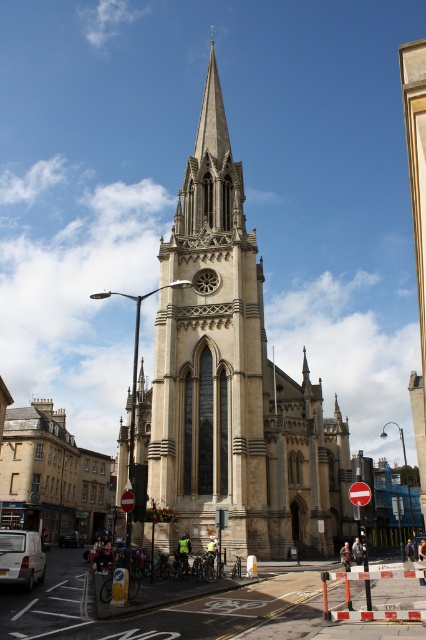
Question: Which object appears closest to the camera in this image?

Choices:
 (A) white matte van at lower left
 (B) metallic silver car at lower left
 (C) beige stone church at lower left

Answer: (A)

Question: Which object appears farthest from the camera in this image?

Choices:
 (A) metallic silver car at lower left
 (B) beige stone tower at center
 (C) white matte van at lower left
 (D) beige stone church at lower left

Answer: (A)

Question: Can you confirm if beige stone church at lower left is bigger than metallic silver car at lower left?

Choices:
 (A) no
 (B) yes

Answer: (B)

Question: Can you confirm if beige stone tower at center is positioned below white matte van at lower left?

Choices:
 (A) yes
 (B) no

Answer: (B)

Question: Is beige stone tower at center to the right of beige stone church at lower left from the viewer's perspective?

Choices:
 (A) no
 (B) yes

Answer: (B)

Question: Which is farther from the beige stone tower at center?

Choices:
 (A) beige stone church at lower left
 (B) metallic silver car at lower left

Answer: (B)